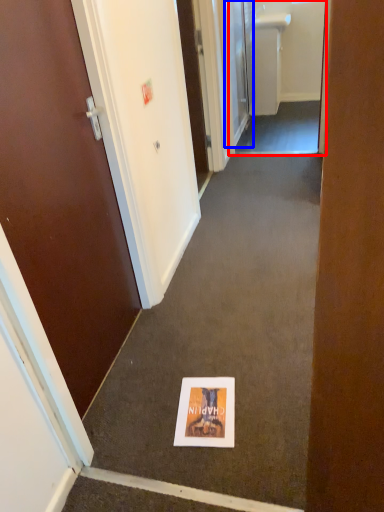
Question: Which object appears closest to the camera in this image, passage (highlighted by a red box) or door (highlighted by a blue box)?

Choices:
 (A) passage
 (B) door

Answer: (A)